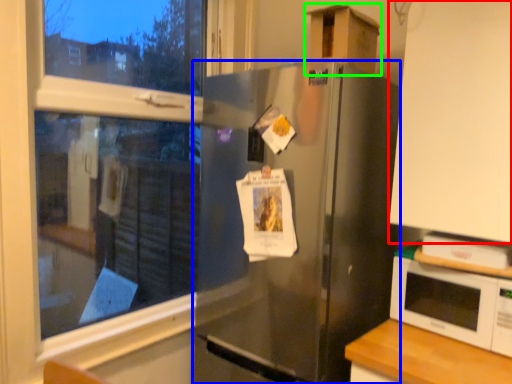
Question: Which object is positioned closest to cabinetry (highlighted by a red box)? Select from refrigerator (highlighted by a blue box) and cardboard box (highlighted by a green box).

Choices:
 (A) refrigerator
 (B) cardboard box

Answer: (A)